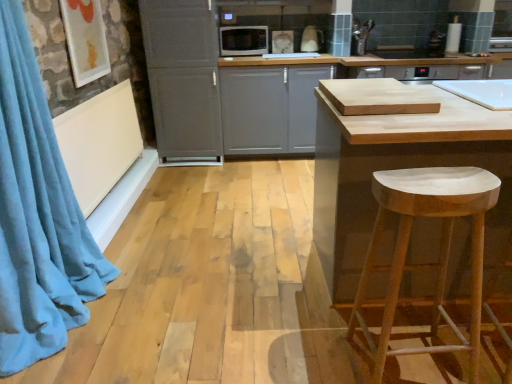
Where is `free space in front of matte gray cabinet at center, the first cabinetry from the left`? The width and height of the screenshot is (512, 384). free space in front of matte gray cabinet at center, the first cabinetry from the left is located at coordinates (195, 177).